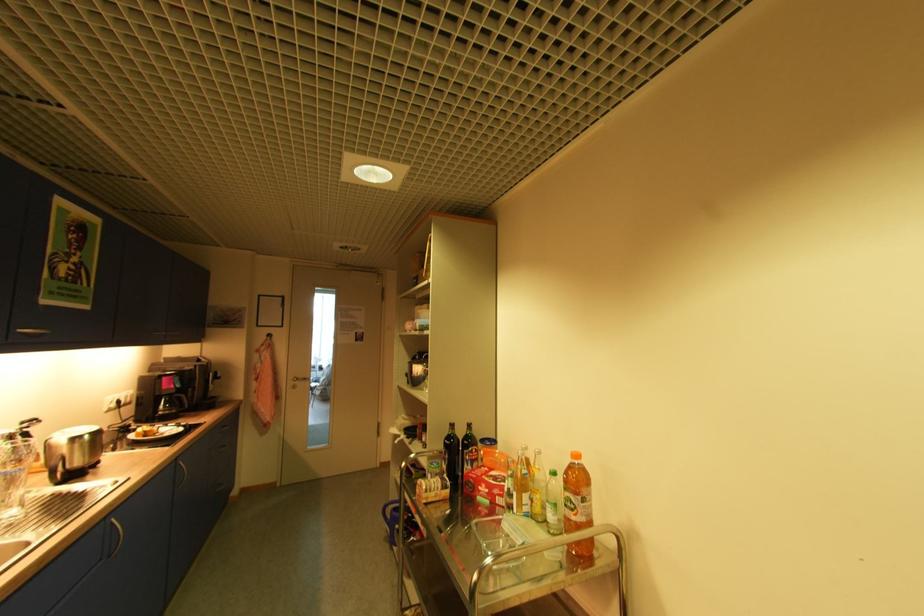
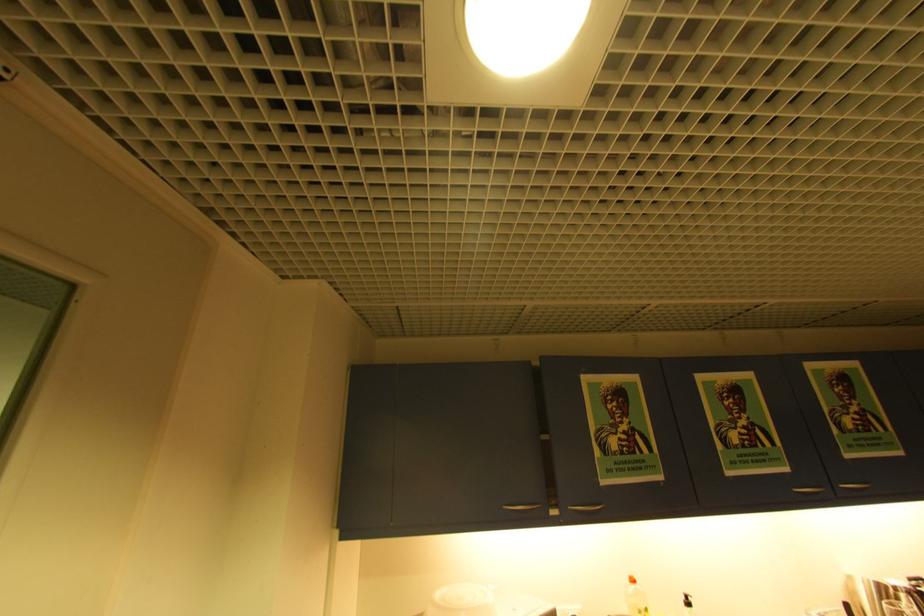
First-person continuous shooting, in which direction is the camera rotating?

The camera rotated toward left-up.